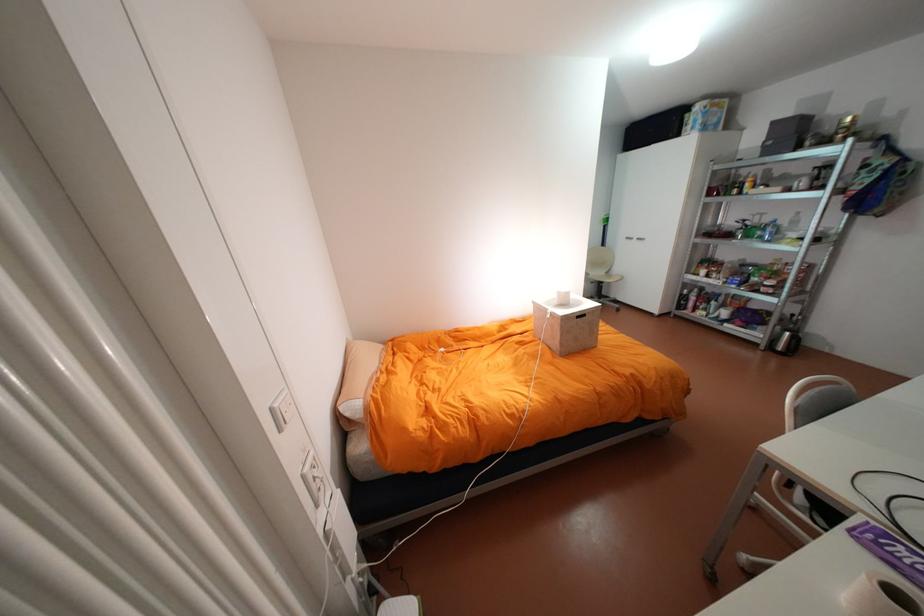
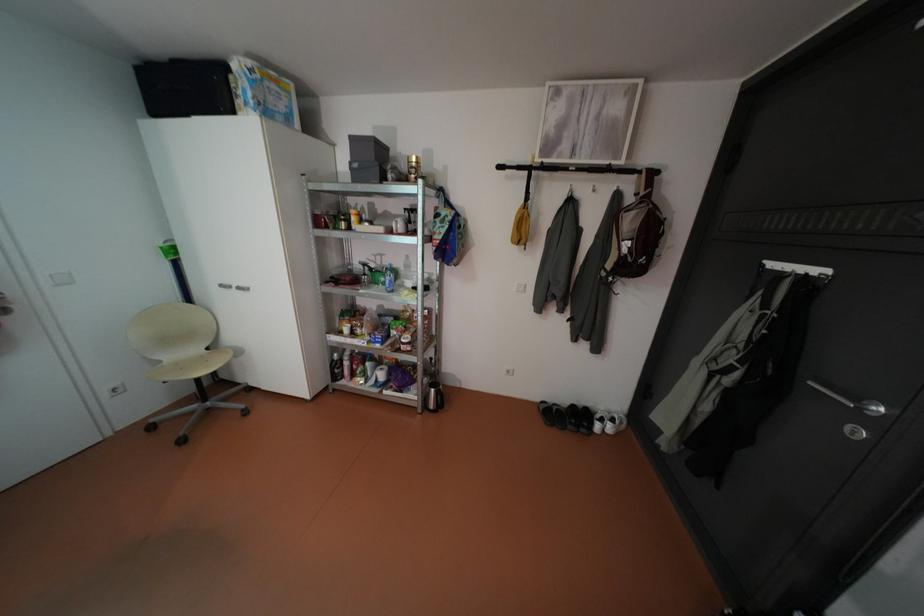
The point at [723,119] is marked in the first image. Where is the corresponding point in the second image?

(290, 107)